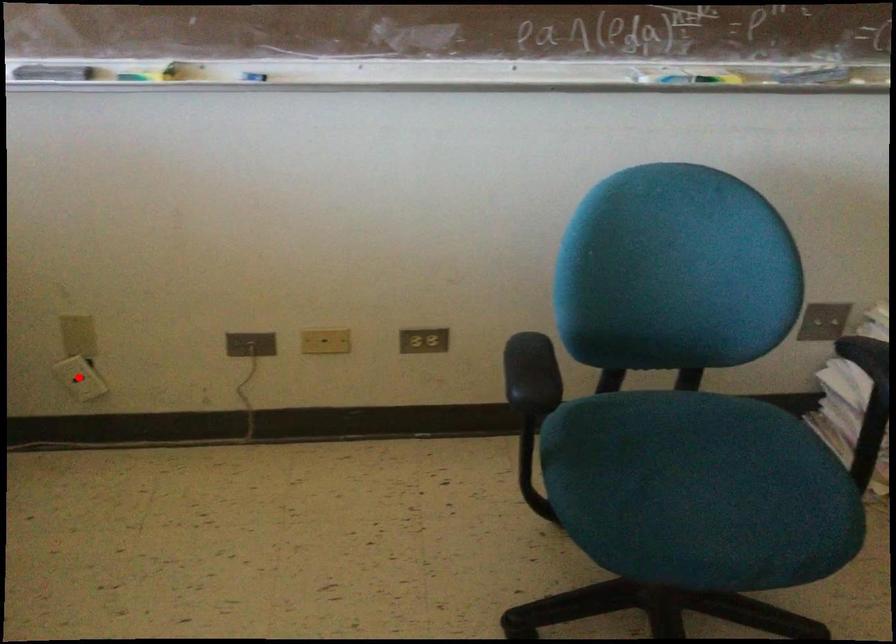
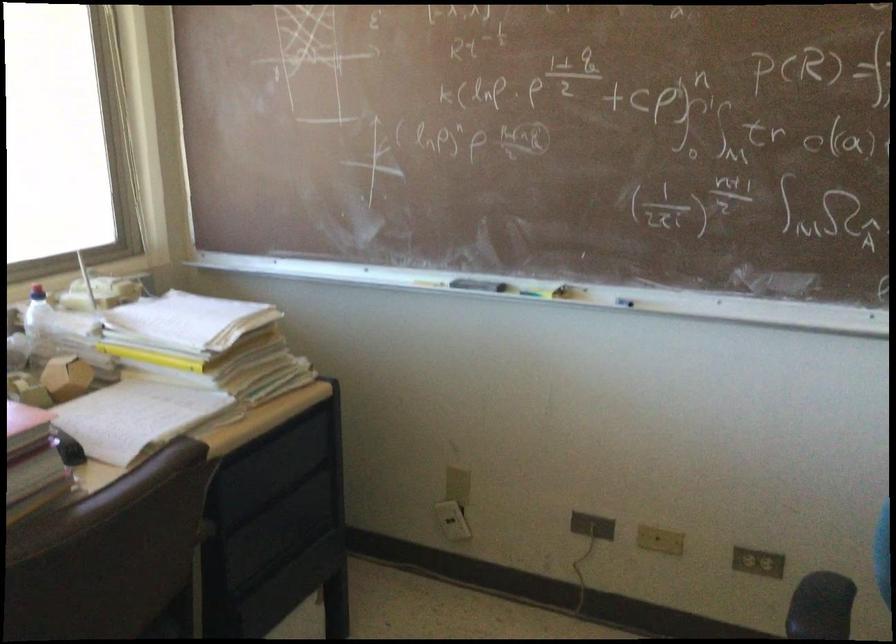
Question: I am providing you with two images of the same scene from different viewpoints. A red point is shown in image1. For the corresponding object point in image2, is it positioned nearer or farther from the camera?

Choices:
 (A) Nearer
 (B) Farther

Answer: (B)